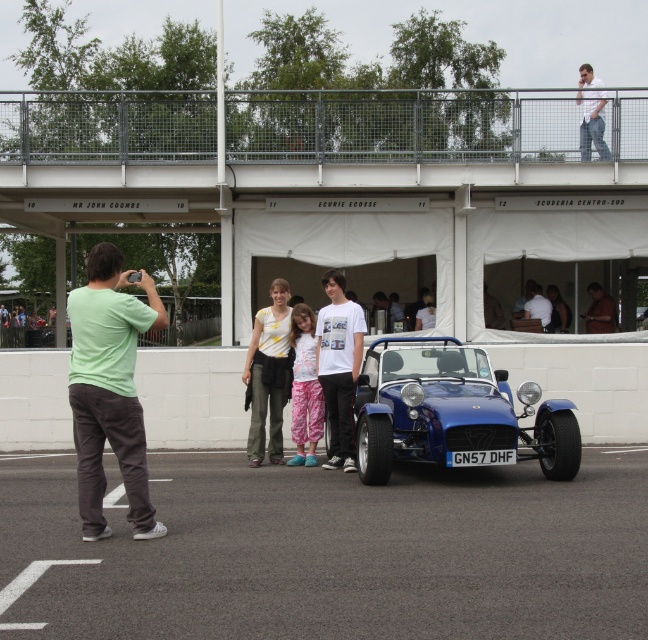
Question: Which point is closer to the camera?

Choices:
 (A) (260, 442)
 (B) (583, 80)
 (C) (445, 410)

Answer: (C)

Question: Which point is closer to the camera taking this photo?

Choices:
 (A) (111, 339)
 (B) (292, 307)
 (C) (371, 413)

Answer: (A)

Question: Does white cotton t-shirt at center appear under white cotton shirt at center?

Choices:
 (A) no
 (B) yes

Answer: (B)

Question: Among these objects, which one is farthest from the camera?

Choices:
 (A) black asphalt at lower center
 (B) shiny blue car at center
 (C) green cotton shirt at left
 (D) white cotton shirt at center

Answer: (D)

Question: Considering the relative positions of green cotton shirt at left and yellow printed shirt at center in the image provided, where is green cotton shirt at left located with respect to yellow printed shirt at center?

Choices:
 (A) above
 (B) below

Answer: (A)

Question: Can you confirm if white cotton t-shirt at center is thinner than light blue shirt at upper right?

Choices:
 (A) no
 (B) yes

Answer: (B)